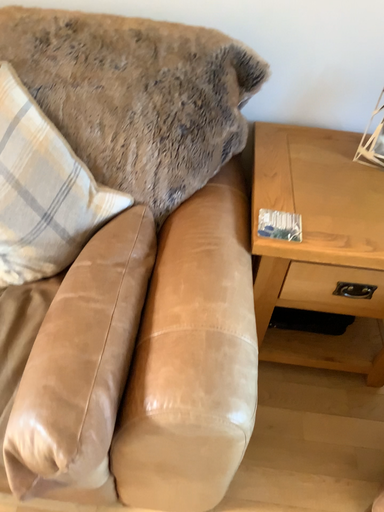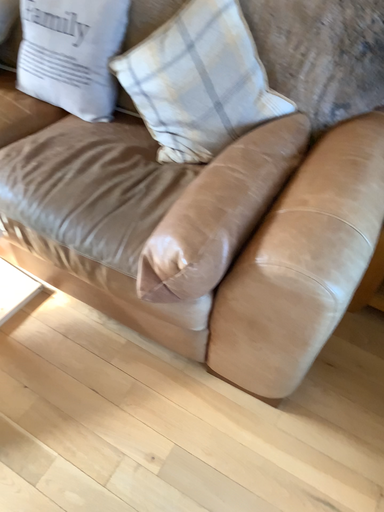
Question: How did the camera likely rotate when shooting the video?

Choices:
 (A) rotated left
 (B) rotated right

Answer: (A)